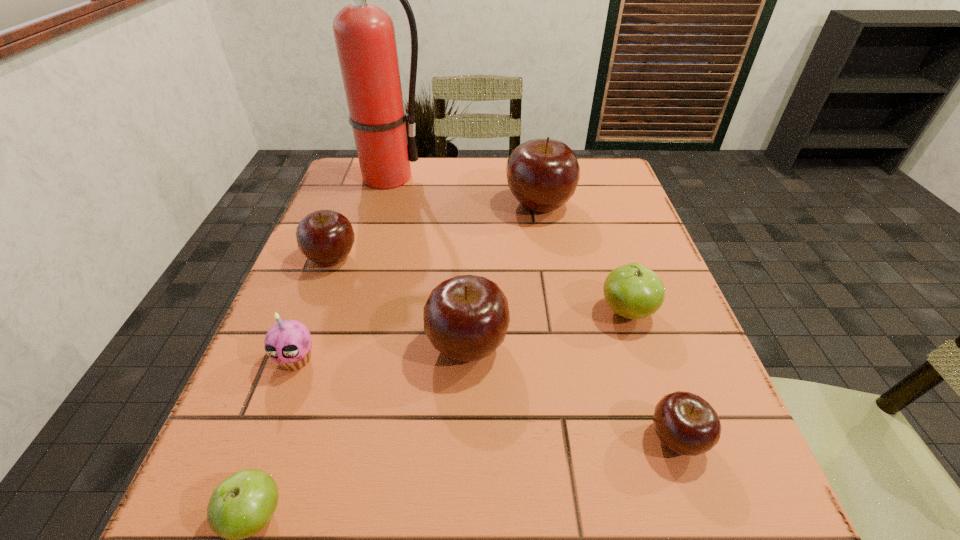
Find the location of a particular element. the smallest red apple is located at coordinates (685, 423).

Identify the location of the second nearest object. The height and width of the screenshot is (540, 960). (685, 423).

You are a GUI agent. You are given a task and a screenshot of the screen. Output one action in this format:
    pyautogui.click(x=<x>, y=<y>)
    Task: Click on the vacant space located on the hose direction of the fire extinguisher
    
    Given the screenshot: What is the action you would take?
    pyautogui.click(x=521, y=177)

Where is `free space located on the back of the farthest red apple`? Image resolution: width=960 pixels, height=540 pixels. free space located on the back of the farthest red apple is located at coordinates (532, 163).

You are a GUI agent. You are given a task and a screenshot of the screen. Output one action in this format:
    pyautogui.click(x=<x>, y=<y>)
    Task: Click on the free space located 0.060m on the right of the second tallest apple
    
    Given the screenshot: What is the action you would take?
    pyautogui.click(x=541, y=345)

The width and height of the screenshot is (960, 540). I want to click on free space located on the back of the second farthest red apple, so click(357, 191).

At what (x,y) coordinates should I click in order to perform the action: click on blank space located on the left of the bigger green apple. Please return your answer as a coordinate pair (x, y). The image size is (960, 540). Looking at the image, I should click on (416, 312).

Locate an element on the screen. The height and width of the screenshot is (540, 960). vacant space located 0.080m on the face of the cupcake is located at coordinates (274, 421).

You are a GUI agent. You are given a task and a screenshot of the screen. Output one action in this format:
    pyautogui.click(x=<x>, y=<y>)
    Task: Click on the free space located 0.380m on the back of the nearest red apple
    The height and width of the screenshot is (540, 960).
    Given the screenshot: What is the action you would take?
    pyautogui.click(x=614, y=255)

Image resolution: width=960 pixels, height=540 pixels. What are the coordinates of `fire extinguisher present at the far edge` in the screenshot? It's located at (364, 33).